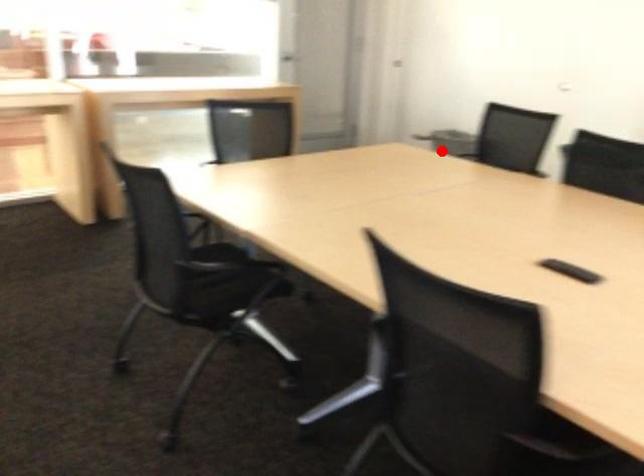
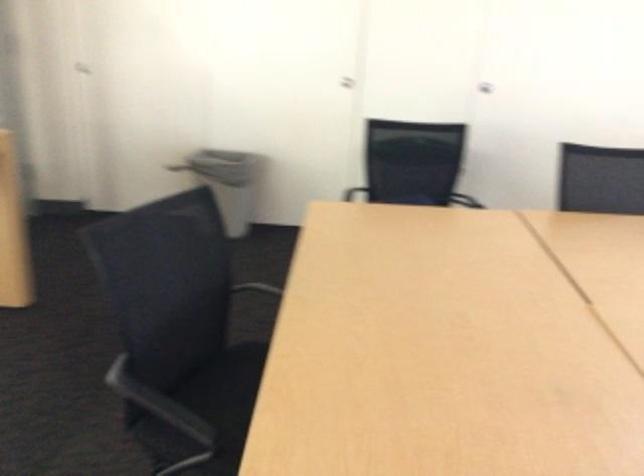
Where in the second image is the point corresponding to the highlighted location from the first image?

(231, 182)